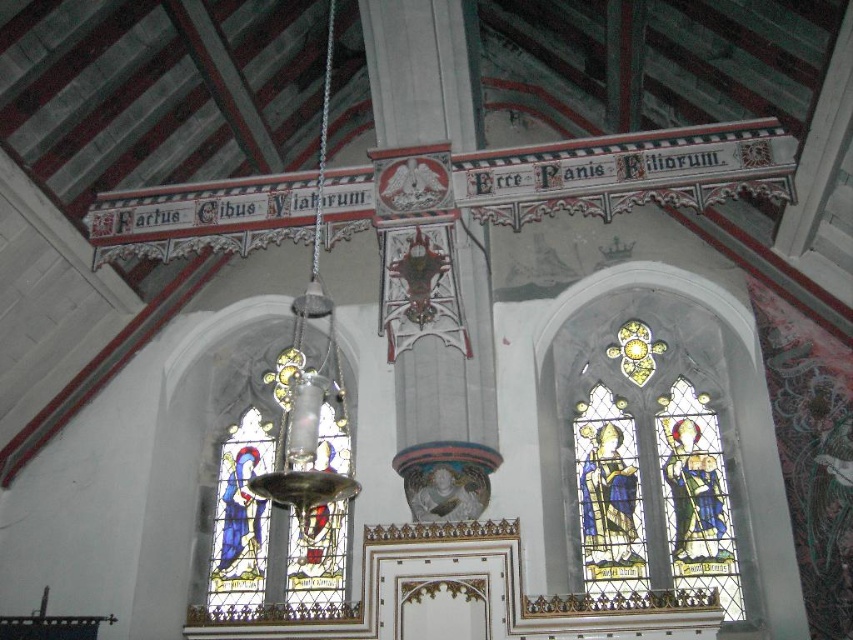
Between stained glass window at right and stained glass window at center, which one is positioned higher?

stained glass window at right is above.

Looking at this image, is stained glass window at right to the right of stained glass window at center from the viewer's perspective?

Correct, you'll find stained glass window at right to the right of stained glass window at center.

In order to click on stained glass window at right in this screenshot , I will do `click(648, 467)`.